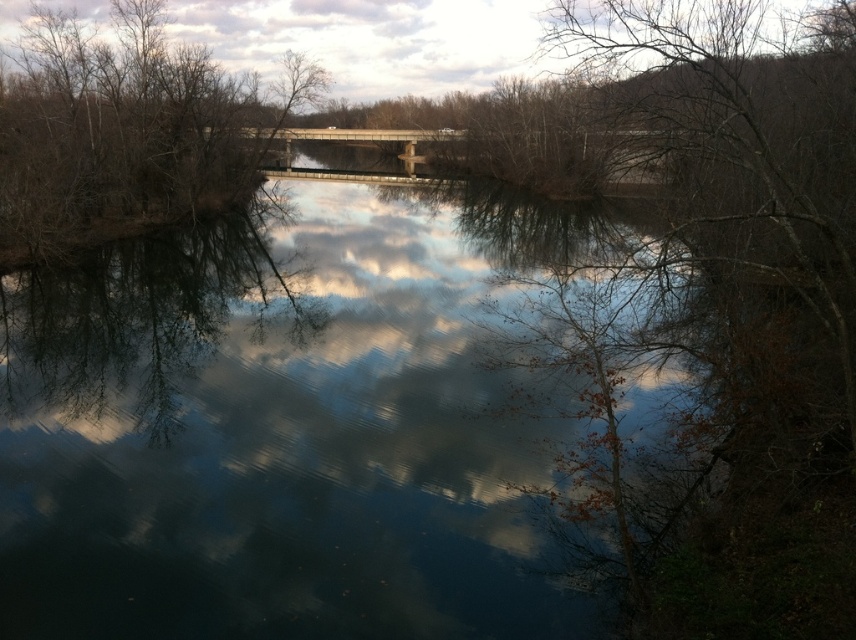
You are standing at the origin point in this scene. Based on the coordinates provided, where exactly is the transparent water at center located?

The transparent water at center is located at the coordinates point (278, 435).